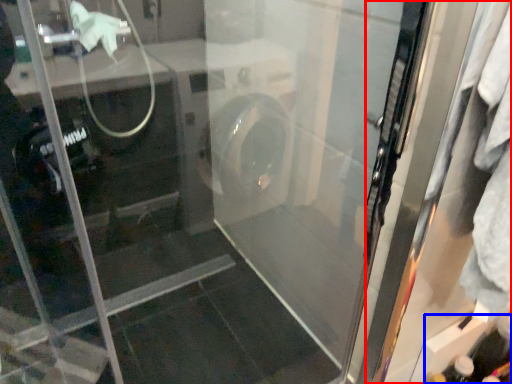
Question: Which object appears closest to the camera in this image, screen door (highlighted by a red box) or bottle (highlighted by a blue box)?

Choices:
 (A) screen door
 (B) bottle

Answer: (A)